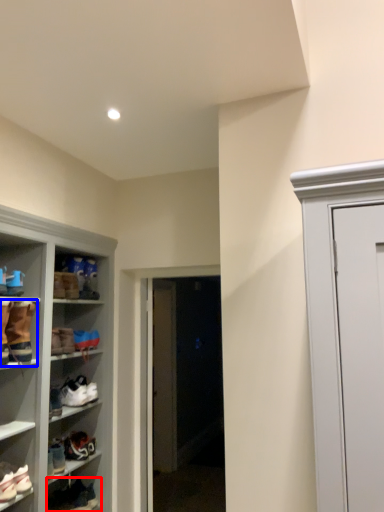
Question: Which point is closer to the camera, footwear (highlighted by a red box) or footwear (highlighted by a blue box)?

Choices:
 (A) footwear
 (B) footwear

Answer: (B)